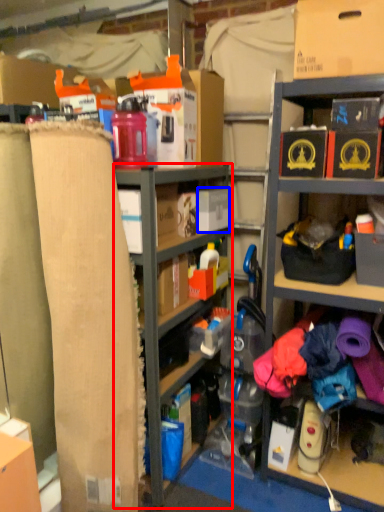
Question: Which object appears farthest to the camera in this image, shelf (highlighted by a red box) or storage box (highlighted by a blue box)?

Choices:
 (A) shelf
 (B) storage box

Answer: (B)